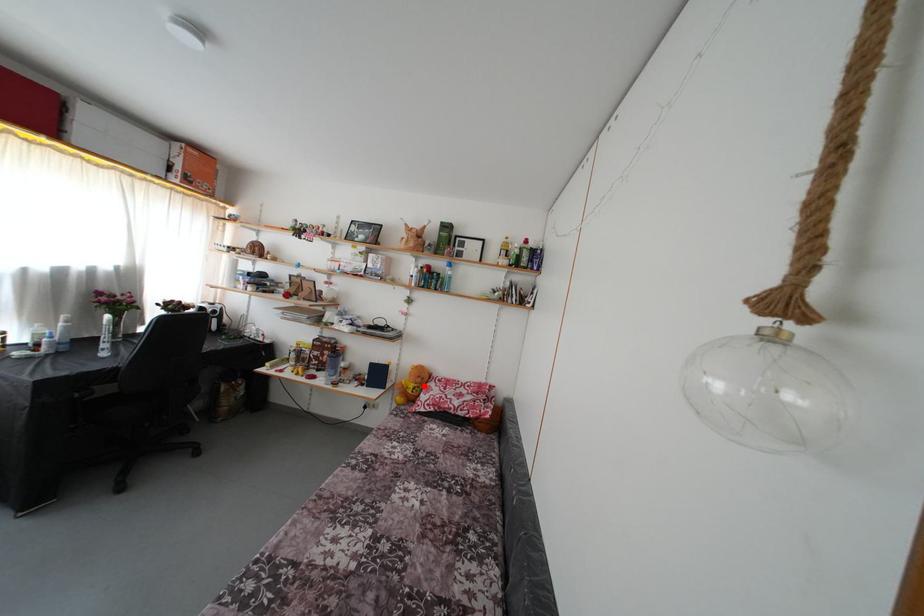
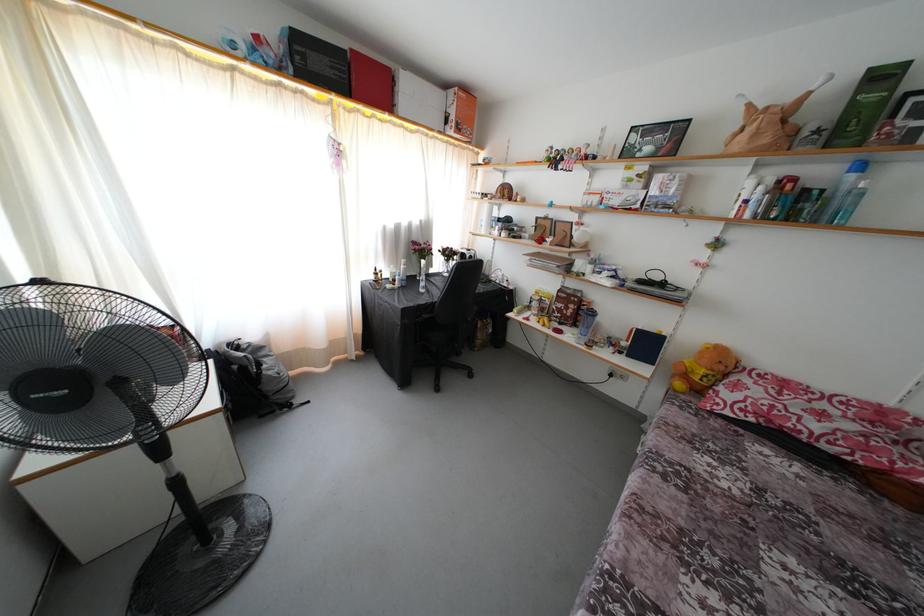
The point at the highlighted location is marked in the first image. Where is the corresponding point in the second image?

(726, 373)